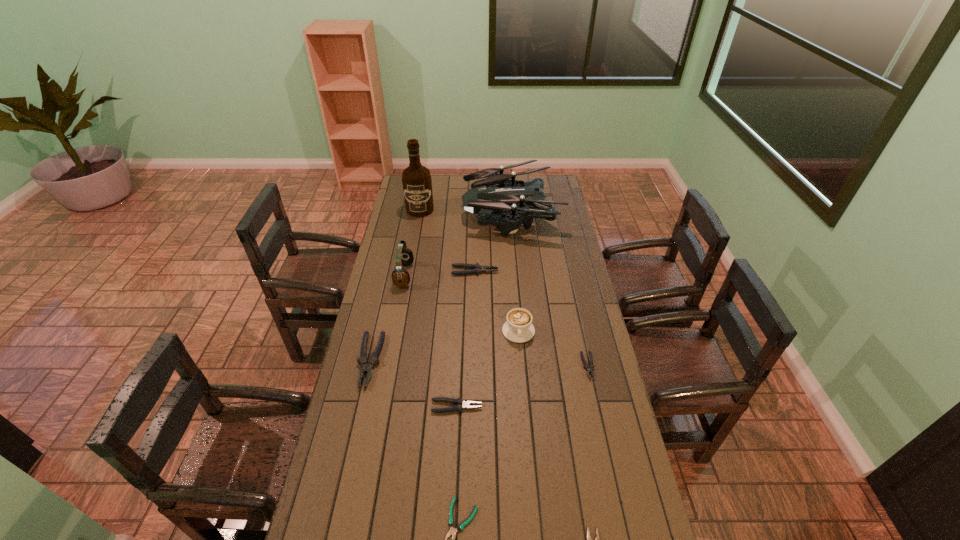
Where is `the tallest object`? The image size is (960, 540). the tallest object is located at coordinates (417, 184).

You are a GUI agent. You are given a task and a screenshot of the screen. Output one action in this format:
    pyautogui.click(x=<x>, y=<y>)
    Task: Click on the alcohol
    The width and height of the screenshot is (960, 540).
    Given the screenshot: What is the action you would take?
    pyautogui.click(x=417, y=184)

The image size is (960, 540). Find the location of `drone`. drone is located at coordinates (492, 195).

Locate an element on the screen. The image size is (960, 540). the eighth shortest object is located at coordinates (404, 256).

Locate an element on the screen. The image size is (960, 540). cappuccino is located at coordinates (518, 328).

The height and width of the screenshot is (540, 960). I want to click on the tallest pliers, so click(366, 365).

What are the coordinates of `the biggest gray pliers` in the screenshot? It's located at (366, 365).

Identify the location of the fifth shortest pliers. (474, 268).

Locate an element on the screen. This screenshot has height=540, width=960. the farthest pliers is located at coordinates (474, 268).

In order to click on the second smallest gray pliers in this screenshot , I will do `click(460, 404)`.